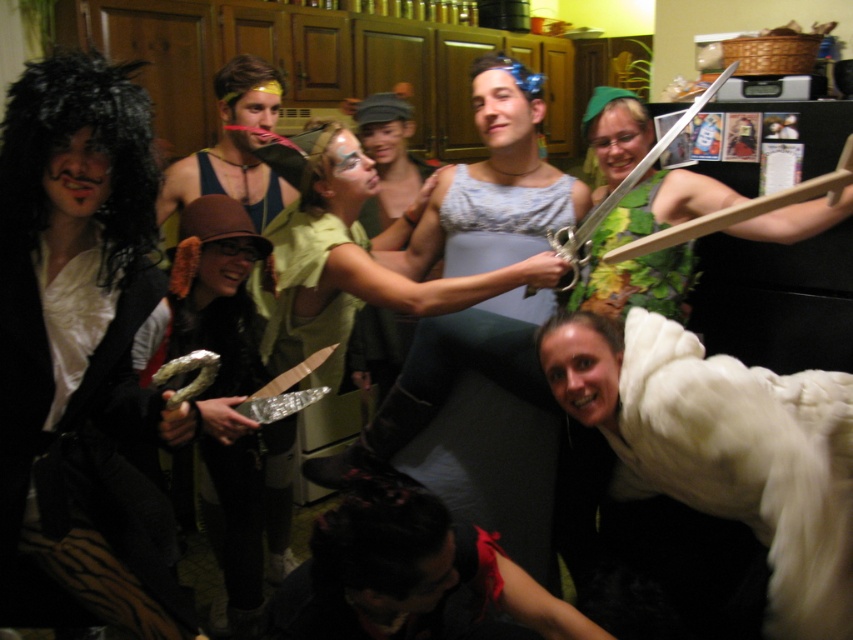
Please provide the 2D coordinates of the shiny black wig at left in the image. The answer should be in the format of a point with two decimal numbers separated by a comma, like 0.12,0.34.

The 2D coordinates of the shiny black wig at left are at point (74, 323).

You are at a costume party in the kitchen and want to find the shiny black wig at left and the blue fabric headband at center. Which one is positioned more to the left side of the kitchen?

The shiny black wig at left is positioned more to the left side of the kitchen than the blue fabric headband at center.

You are planning to hang both the black velvet mask at lower center and the brown fabric hat at center on a wall. Which object should you place higher on the wall to ensure they are both visible without overlapping?

Since the black velvet mask at lower center is shorter than the brown fabric hat at center, you should place the brown fabric hat at center higher on the wall to accommodate its greater height and ensure visibility without overlapping.